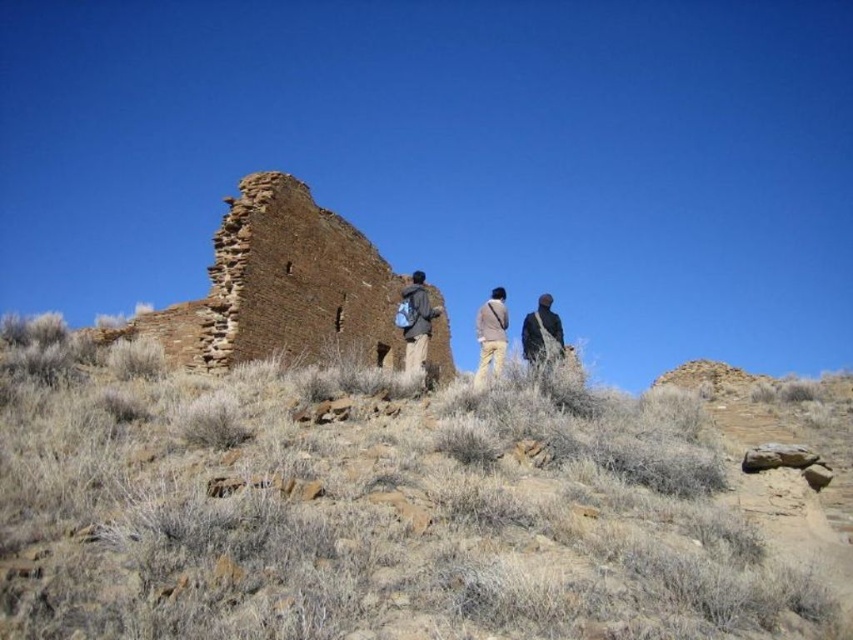
Is dark brown leather jacket at center taller than khaki pants at center?

In fact, dark brown leather jacket at center may be shorter than khaki pants at center.

Which of these two, dark brown leather jacket at center or khaki pants at center, stands shorter?

A: With less height is dark brown leather jacket at center.

Is point (546, 342) positioned behind point (480, 348)?

No, (546, 342) is in front of (480, 348).

Where is `dark brown leather jacket at center`? dark brown leather jacket at center is located at coordinates (491, 333).

Between brown rock at center and khaki pants at center, which one has more height?

With more height is brown rock at center.

Does brown rock at center appear on the right side of khaki pants at center?

In fact, brown rock at center is to the left of khaki pants at center.

At what (x,y) coordinates should I click in order to perform the action: click on brown rock at center. Please return your answer as a coordinate pair (x, y). Looking at the image, I should click on (x=364, y=508).

I want to click on brown rock at center, so pyautogui.click(x=364, y=508).

Which is above, dark brown jacket at center or khaki pants at center?

Positioned higher is dark brown jacket at center.

Does dark brown jacket at center appear on the left side of khaki pants at center?

Correct, you'll find dark brown jacket at center to the left of khaki pants at center.

Locate an element on the screen. dark brown jacket at center is located at coordinates (415, 321).

Identify the location of dark brown jacket at center. This screenshot has width=853, height=640. (415, 321).